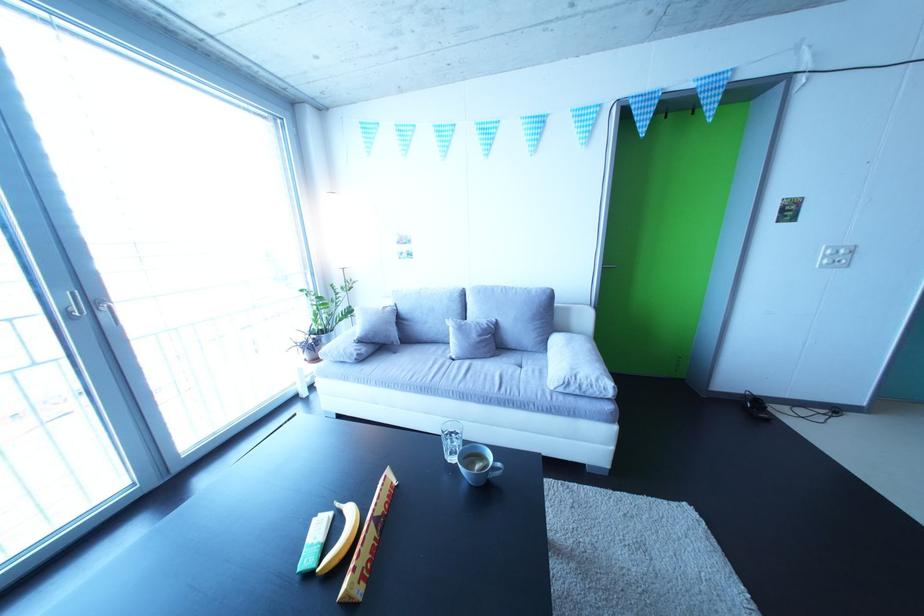
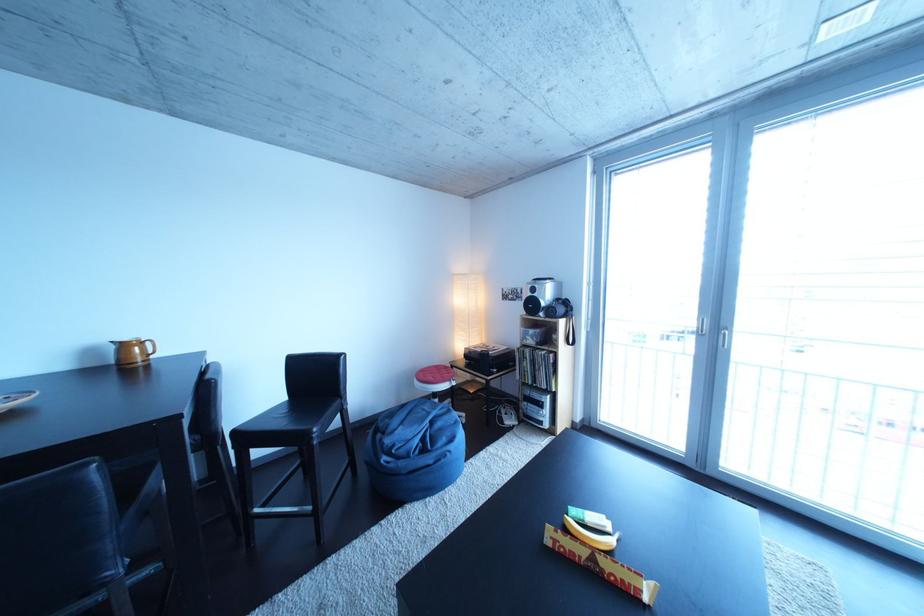
Find the pixel in the second image that matches the point at 393,517 in the first image.

(617, 570)